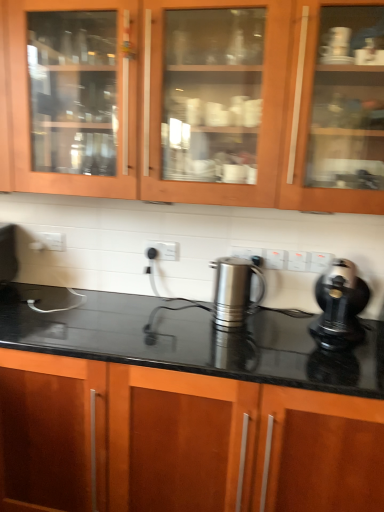
This screenshot has width=384, height=512. What do you see at coordinates (201, 103) in the screenshot? I see `matte wood cabinets at upper center, acting as the 2th cabinetry starting from the bottom` at bounding box center [201, 103].

Locate an element on the screen. polished stainless steel kettle at center is located at coordinates (234, 291).

Which of these two, polished stainless steel kettle at center or black glossy countertop at center, which is the first cabinetry from bottom to top, stands taller?

black glossy countertop at center, which is the first cabinetry from bottom to top, is taller.

Considering their positions, is polished stainless steel kettle at center located in front of or behind black glossy countertop at center, which is the first cabinetry from bottom to top?

Clearly, polished stainless steel kettle at center is behind black glossy countertop at center, which is the first cabinetry from bottom to top.

Could black glossy countertop at center, arranged as the second cabinetry when viewed from the top, be considered to be inside polished stainless steel kettle at center?

That's incorrect, black glossy countertop at center, arranged as the second cabinetry when viewed from the top, is not inside polished stainless steel kettle at center.

Could you tell me if polished stainless steel kettle at center is turned towards black glossy countertop at center, arranged as the second cabinetry when viewed from the top?

No.

From the image's perspective, is polished stainless steel kettle at center above matte wood cabinets at upper center, arranged as the first cabinetry when viewed from the top?

Incorrect, from the image's perspective, polished stainless steel kettle at center is lower than matte wood cabinets at upper center, arranged as the first cabinetry when viewed from the top.

Between polished stainless steel kettle at center and matte wood cabinets at upper center, acting as the 2th cabinetry starting from the bottom, which one has larger size?

matte wood cabinets at upper center, acting as the 2th cabinetry starting from the bottom, is bigger.

Which cabinetry is the 1st one when counting from the left side of the polished stainless steel kettle at center? Please provide its 2D coordinates.

[(201, 103)]

You are a GUI agent. You are given a task and a screenshot of the screen. Output one action in this format:
    pyautogui.click(x=<x>, y=<y>)
    Task: Click on the 2nd cabinetry to the left of the black plastic kettle at right, counting from the anchor's position
    The width and height of the screenshot is (384, 512).
    Given the screenshot: What is the action you would take?
    pyautogui.click(x=181, y=440)

Who is more distant, black plastic kettle at right or black glossy countertop at center, arranged as the second cabinetry when viewed from the top?

black plastic kettle at right is more distant.

Considering the positions of point (348, 317) and point (50, 500), is point (348, 317) closer or farther from the camera than point (50, 500)?

Point (348, 317) appears to be closer to the viewer than point (50, 500).

Looking at this image, from a real-world perspective, is black plastic kettle at right positioned above or below black glossy countertop at center, which is the first cabinetry from bottom to top?

Clearly, from a real-world perspective, black plastic kettle at right is above black glossy countertop at center, which is the first cabinetry from bottom to top.

Is matte wood cabinets at upper center, arranged as the first cabinetry when viewed from the top, next to black plastic kettle at right and touching it?

matte wood cabinets at upper center, arranged as the first cabinetry when viewed from the top, and black plastic kettle at right are not in contact.

Measure the distance from matte wood cabinets at upper center, arranged as the first cabinetry when viewed from the top, to black plastic kettle at right.

27.55 inches.

Is matte wood cabinets at upper center, acting as the 2th cabinetry starting from the bottom, situated inside black plastic kettle at right or outside?

matte wood cabinets at upper center, acting as the 2th cabinetry starting from the bottom, is located beyond the bounds of black plastic kettle at right.

Which is further, (206,41) or (343,286)?

Positioned behind is point (206,41).

Considering the sizes of objects matte wood cabinets at upper center, acting as the 2th cabinetry starting from the bottom, and polished stainless steel kettle at center in the image provided, who is shorter, matte wood cabinets at upper center, acting as the 2th cabinetry starting from the bottom, or polished stainless steel kettle at center?

Standing shorter between the two is polished stainless steel kettle at center.

Which is more to the left, matte wood cabinets at upper center, arranged as the first cabinetry when viewed from the top, or polished stainless steel kettle at center?

Positioned to the left is matte wood cabinets at upper center, arranged as the first cabinetry when viewed from the top.

Is matte wood cabinets at upper center, acting as the 2th cabinetry starting from the bottom, not near polished stainless steel kettle at center?

No, matte wood cabinets at upper center, acting as the 2th cabinetry starting from the bottom, is not far from polished stainless steel kettle at center.

Is black glossy countertop at center, which is the first cabinetry from bottom to top, aimed at polished stainless steel kettle at center?

No, black glossy countertop at center, which is the first cabinetry from bottom to top, is not aimed at polished stainless steel kettle at center.

Can you see black glossy countertop at center, which is the first cabinetry from bottom to top, touching polished stainless steel kettle at center?

black glossy countertop at center, which is the first cabinetry from bottom to top, and polished stainless steel kettle at center are clearly separated.

Considering the points (320, 470) and (211, 267), which point is behind, point (320, 470) or point (211, 267)?

The point (211, 267) is farther from the camera.

Is black glossy countertop at center, arranged as the second cabinetry when viewed from the top, in front of or behind black plastic kettle at right in the image?

In the image, black glossy countertop at center, arranged as the second cabinetry when viewed from the top, appears in front of black plastic kettle at right.

Consider the image. Could black plastic kettle at right be considered to be inside black glossy countertop at center, arranged as the second cabinetry when viewed from the top?

Definitely not — black plastic kettle at right is not inside black glossy countertop at center, arranged as the second cabinetry when viewed from the top.

From the image's perspective, is black glossy countertop at center, which is the first cabinetry from bottom to top, above black plastic kettle at right?

No, from the image's perspective, black glossy countertop at center, which is the first cabinetry from bottom to top, is not above black plastic kettle at right.

Is black glossy countertop at center, which is the first cabinetry from bottom to top, facing towards black plastic kettle at right?

No, black glossy countertop at center, which is the first cabinetry from bottom to top, is not oriented towards black plastic kettle at right.

Locate an element on the screen. kitchen appliance above the black glossy countertop at center, which is the first cabinetry from bottom to top (from the image's perspective) is located at coordinates (234, 291).

Locate an element on the screen. The image size is (384, 512). kitchen appliance located underneath the matte wood cabinets at upper center, arranged as the first cabinetry when viewed from the top (from a real-world perspective) is located at coordinates (234, 291).

Estimate the real-world distances between objects in this image. Which object is further from matte wood cabinets at upper center, arranged as the first cabinetry when viewed from the top, polished stainless steel kettle at center or black glossy countertop at center, which is the first cabinetry from bottom to top?

Based on the image, black glossy countertop at center, which is the first cabinetry from bottom to top, appears to be further to matte wood cabinets at upper center, arranged as the first cabinetry when viewed from the top.

Estimate the real-world distances between objects in this image. Which object is closer to black plastic kettle at right, matte wood cabinets at upper center, acting as the 2th cabinetry starting from the bottom, or polished stainless steel kettle at center?

polished stainless steel kettle at center is closer to black plastic kettle at right.

Estimate the real-world distances between objects in this image. Which object is closer to matte wood cabinets at upper center, arranged as the first cabinetry when viewed from the top, black plastic kettle at right or black glossy countertop at center, which is the first cabinetry from bottom to top?

The object closer to matte wood cabinets at upper center, arranged as the first cabinetry when viewed from the top, is black plastic kettle at right.

Which object lies further to the anchor point black glossy countertop at center, which is the first cabinetry from bottom to top, matte wood cabinets at upper center, arranged as the first cabinetry when viewed from the top, or black plastic kettle at right?

matte wood cabinets at upper center, arranged as the first cabinetry when viewed from the top, lies further to black glossy countertop at center, which is the first cabinetry from bottom to top, than the other object.

Based on their spatial positions, is polished stainless steel kettle at center or black plastic kettle at right further from matte wood cabinets at upper center, arranged as the first cabinetry when viewed from the top?

The object further to matte wood cabinets at upper center, arranged as the first cabinetry when viewed from the top, is black plastic kettle at right.

Estimate the real-world distances between objects in this image. Which object is closer to black plastic kettle at right, black glossy countertop at center, which is the first cabinetry from bottom to top, or polished stainless steel kettle at center?

Based on the image, polished stainless steel kettle at center appears to be nearer to black plastic kettle at right.

From the image, which object appears to be nearer to black glossy countertop at center, arranged as the second cabinetry when viewed from the top, black plastic kettle at right or matte wood cabinets at upper center, acting as the 2th cabinetry starting from the bottom?

black plastic kettle at right is positioned closer to the anchor black glossy countertop at center, arranged as the second cabinetry when viewed from the top.

Considering their positions, is black plastic kettle at right positioned further to polished stainless steel kettle at center than matte wood cabinets at upper center, arranged as the first cabinetry when viewed from the top?

matte wood cabinets at upper center, arranged as the first cabinetry when viewed from the top, is further to polished stainless steel kettle at center.

Identify the location of home appliance between matte wood cabinets at upper center, arranged as the first cabinetry when viewed from the top, and black glossy countertop at center, arranged as the second cabinetry when viewed from the top, vertically. click(339, 306).

Locate an element on the screen. The height and width of the screenshot is (512, 384). kitchen appliance between matte wood cabinets at upper center, acting as the 2th cabinetry starting from the bottom, and black glossy countertop at center, arranged as the second cabinetry when viewed from the top, in the up-down direction is located at coordinates (234, 291).

The width and height of the screenshot is (384, 512). What are the coordinates of `kitchen appliance between matte wood cabinets at upper center, acting as the 2th cabinetry starting from the bottom, and black plastic kettle at right in the up-down direction` in the screenshot? It's located at (234, 291).

Where is `kitchen appliance located between black glossy countertop at center, which is the first cabinetry from bottom to top, and black plastic kettle at right in the left-right direction`? This screenshot has height=512, width=384. kitchen appliance located between black glossy countertop at center, which is the first cabinetry from bottom to top, and black plastic kettle at right in the left-right direction is located at coordinates (234, 291).